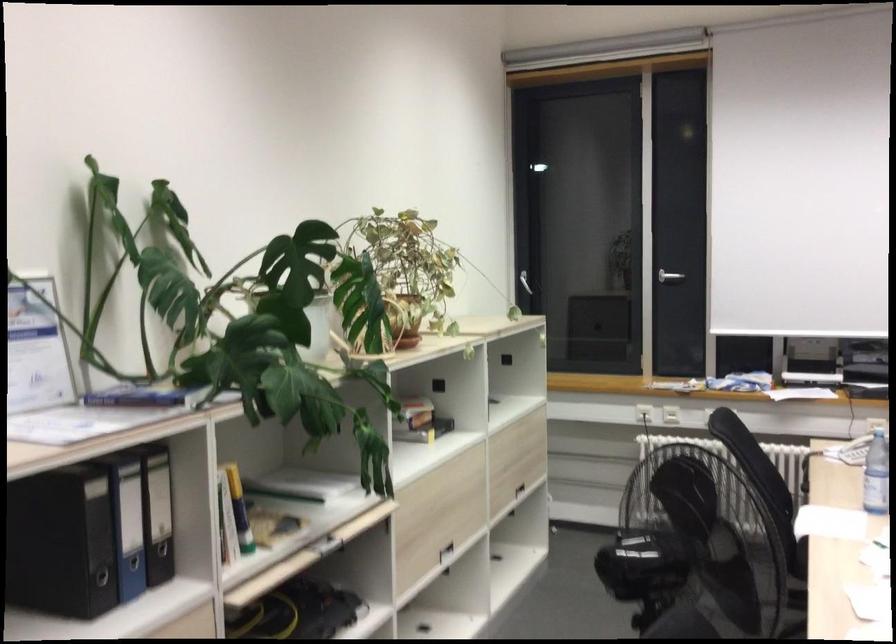
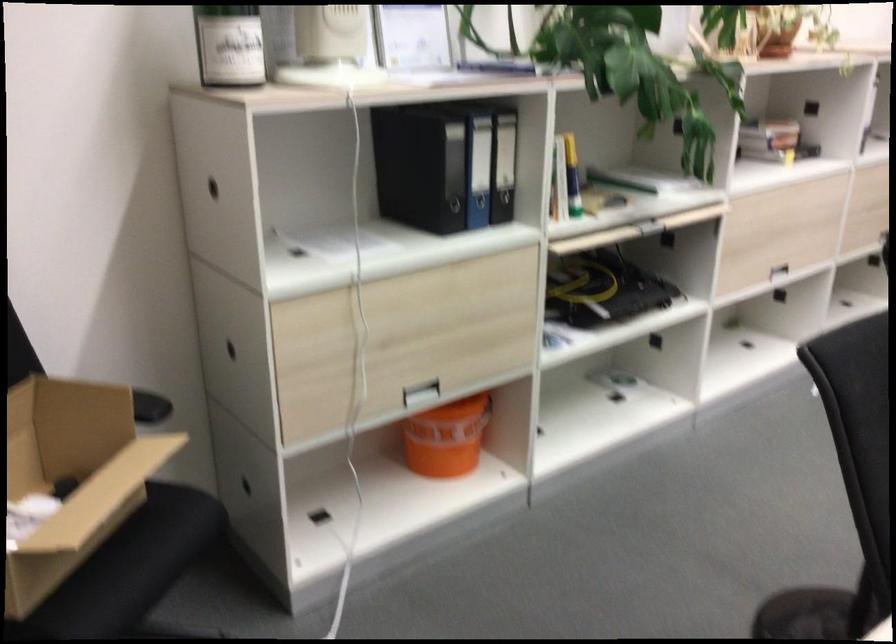
The images are taken continuously from a first-person perspective. In which direction is your viewpoint rotating?

The camera's rotation is toward left-down.